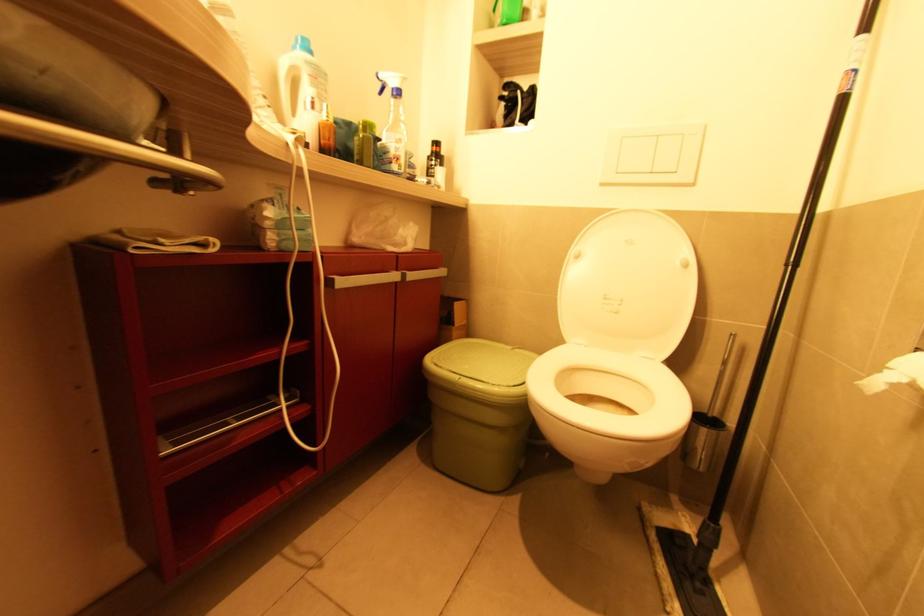
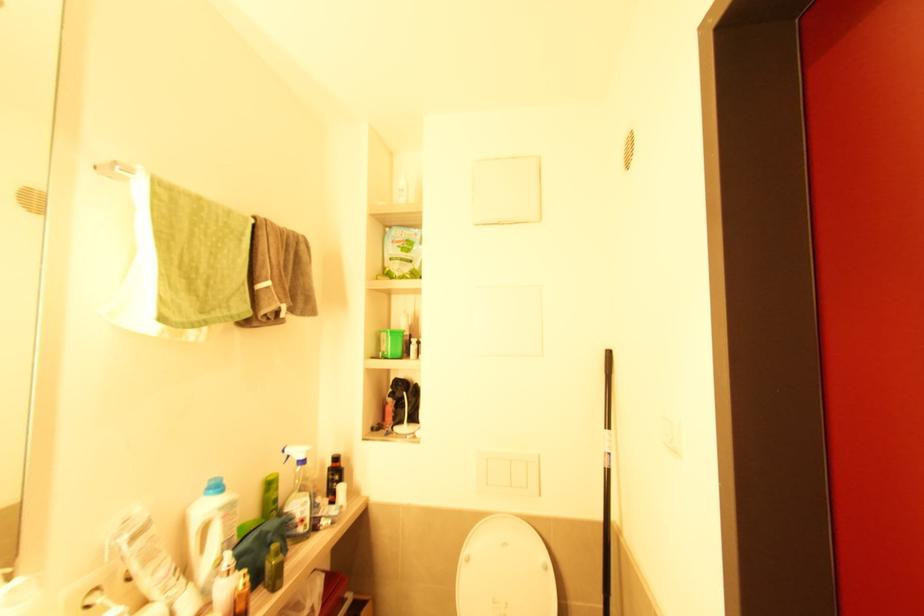
In the second image, find the point that corresponds to (399,94) in the first image.

(305, 462)